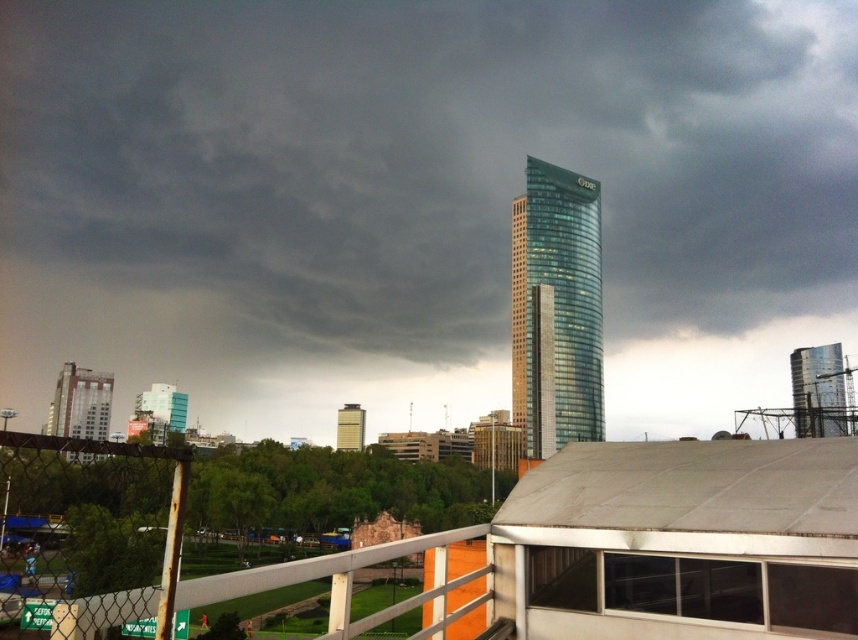
Who is higher up, dark gray glass skyscraper at center or glassy teal skyscraper at center?

dark gray glass skyscraper at center is higher up.

This screenshot has height=640, width=858. Describe the element at coordinates (412, 168) in the screenshot. I see `dark gray glass skyscraper at center` at that location.

This screenshot has height=640, width=858. What are the coordinates of `dark gray glass skyscraper at center` in the screenshot? It's located at (412, 168).

Is point (71, 417) more distant than point (353, 436)?

Yes, point (71, 417) is farther from viewer.

Is point (76, 452) closer to camera compared to point (360, 436)?

Yes, point (76, 452) is in front of point (360, 436).

Identify the location of matte silver building at left. The image size is (858, 640). (80, 403).

Can you confirm if blue glass building at lower left is bigger than matte gray building at center?

Yes, blue glass building at lower left is bigger than matte gray building at center.

Where is `blue glass building at lower left`? The width and height of the screenshot is (858, 640). blue glass building at lower left is located at coordinates (164, 404).

This screenshot has width=858, height=640. What do you see at coordinates (164, 404) in the screenshot?
I see `blue glass building at lower left` at bounding box center [164, 404].

Locate an element on the screen. This screenshot has height=640, width=858. blue glass building at lower left is located at coordinates pyautogui.click(x=164, y=404).